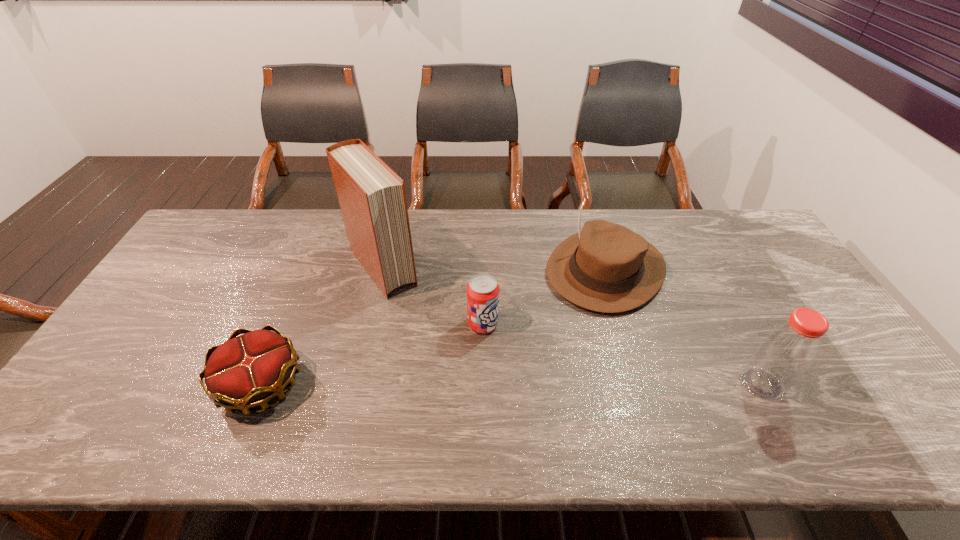
The width and height of the screenshot is (960, 540). Find the location of `object identified as the fourth closest to the rightmost object`. object identified as the fourth closest to the rightmost object is located at coordinates (246, 371).

This screenshot has height=540, width=960. Identify the location of object that stands as the fourth closest to the crown. (786, 352).

Identify the location of free region that satisfies the following two spatial constraints: 1. on the front side of the second object from right to left; 2. on the right side of the tallest object. Image resolution: width=960 pixels, height=540 pixels. (383, 269).

Identify the location of free space that satisfies the following two spatial constraints: 1. on the front side of the fourth object from right to left; 2. on the left side of the bottle. The height and width of the screenshot is (540, 960). (356, 384).

Identify the location of vacant region that satisfies the following two spatial constraints: 1. on the front side of the rightmost object; 2. on the right side of the fourth tallest object. The height and width of the screenshot is (540, 960). point(483,384).